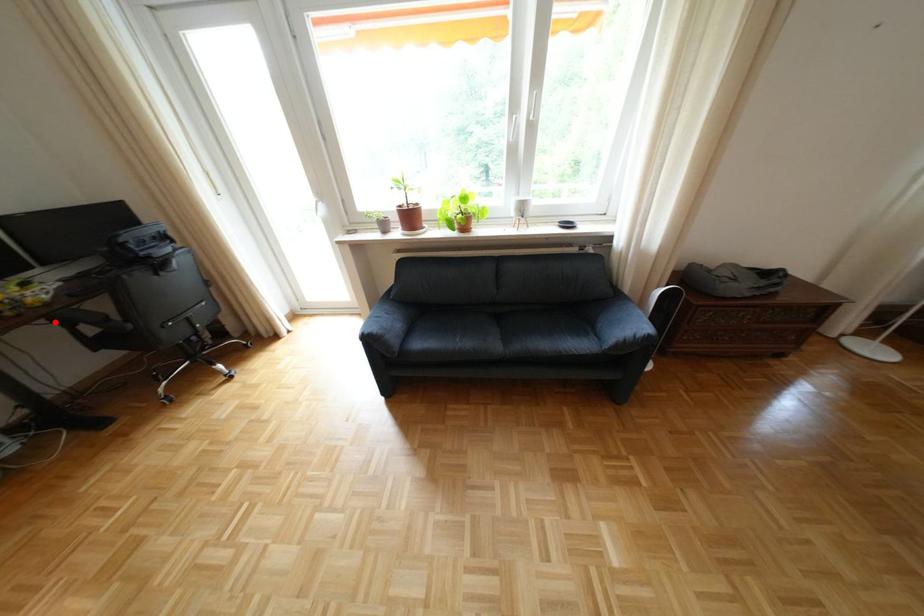
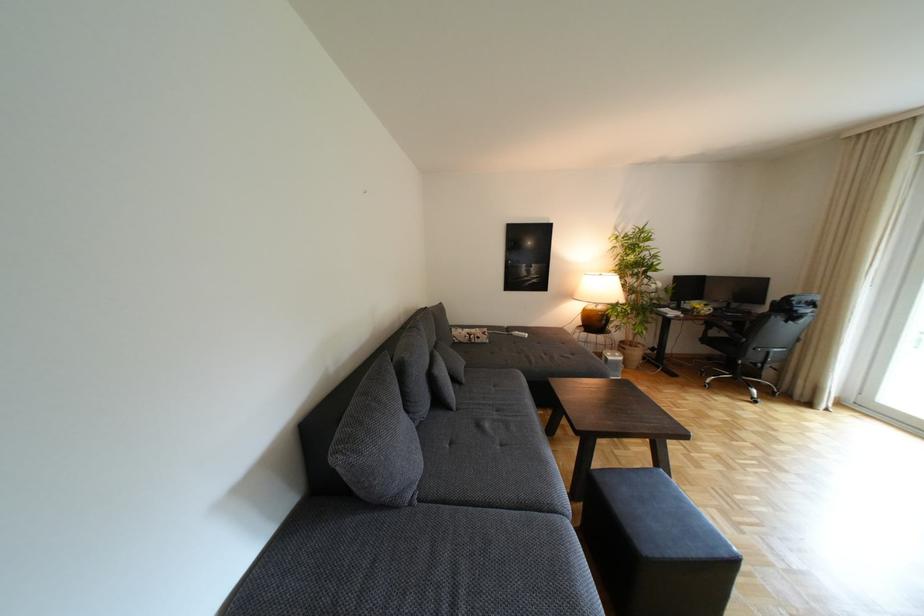
Question: I am providing you with two images of the same scene from different viewpoints. A red point is marked on the first image. At the location where the point appears in image 1, is it still visible in image 2?

Choices:
 (A) Yes
 (B) No

Answer: (A)